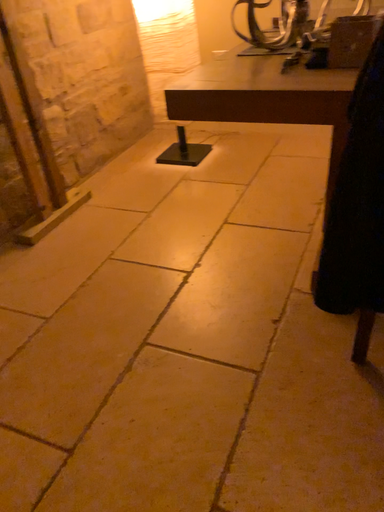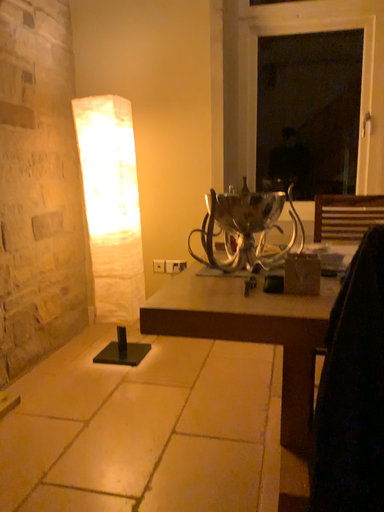
Question: Which way did the camera rotate in the video?

Choices:
 (A) rotated right
 (B) rotated left

Answer: (A)